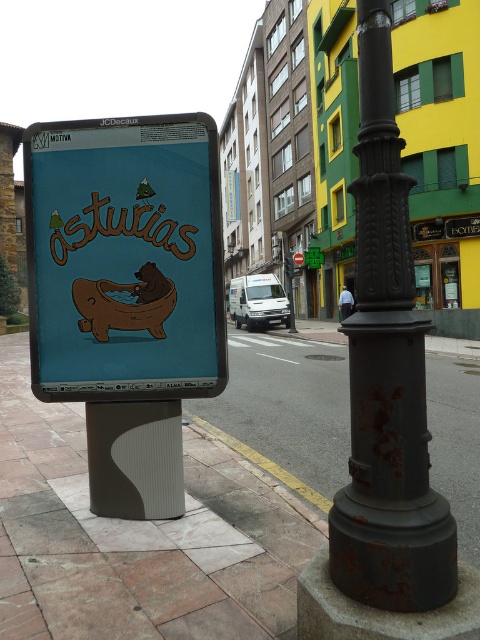
Which is below, rusty metal pole at lower center or brown matte hippo at center?

Positioned lower is rusty metal pole at lower center.

This screenshot has width=480, height=640. What do you see at coordinates (286, 410) in the screenshot?
I see `rusty metal pole at lower center` at bounding box center [286, 410].

Find the location of a particular element. Image resolution: width=480 pixels, height=640 pixels. rusty metal pole at lower center is located at coordinates (286, 410).

Is rusty metal pole at center shorter than rusty metal pole at lower center?

Yes, rusty metal pole at center is shorter than rusty metal pole at lower center.

Is point (372, 588) positioned behind point (259, 461)?

No, it is not.

Does point (408, 248) come farther from viewer compared to point (321, 371)?

No, it is in front of (321, 371).

The width and height of the screenshot is (480, 640). Find the location of `rusty metal pole at center`. rusty metal pole at center is located at coordinates (386, 374).

Does point (365, 177) come farther from viewer compared to point (322, 252)?

That is False.

This screenshot has width=480, height=640. Identify the location of rusty metal pole at center. (386, 374).